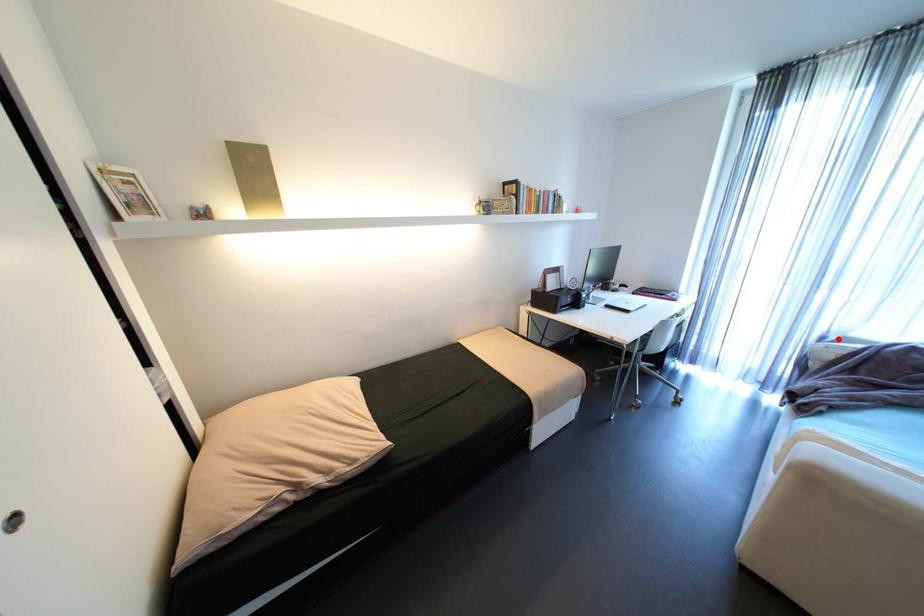
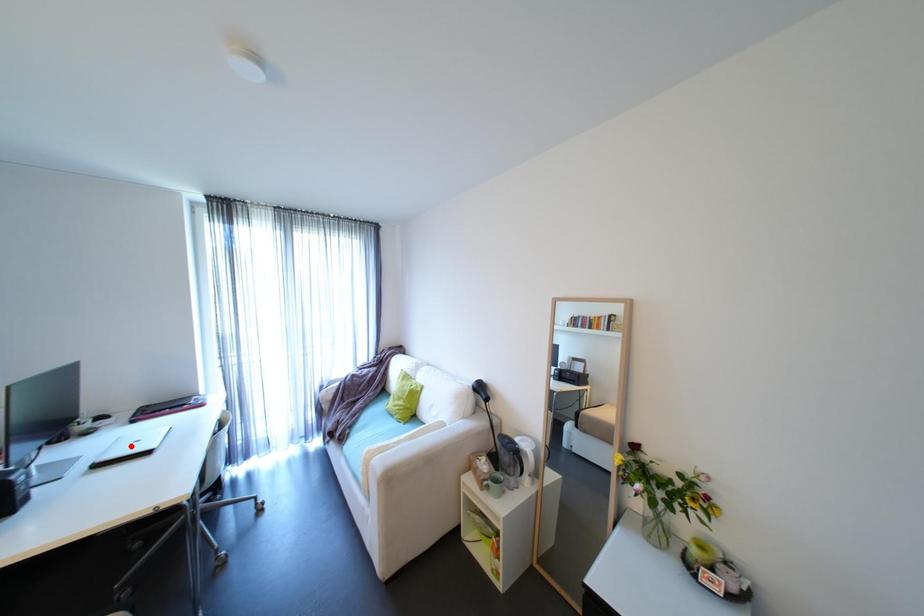
I am providing you with two images of the same scene from different viewpoints. A red point is marked on the first image and another point is marked on the second image. Is the red point in image1 aligned with the point shown in image2?

No